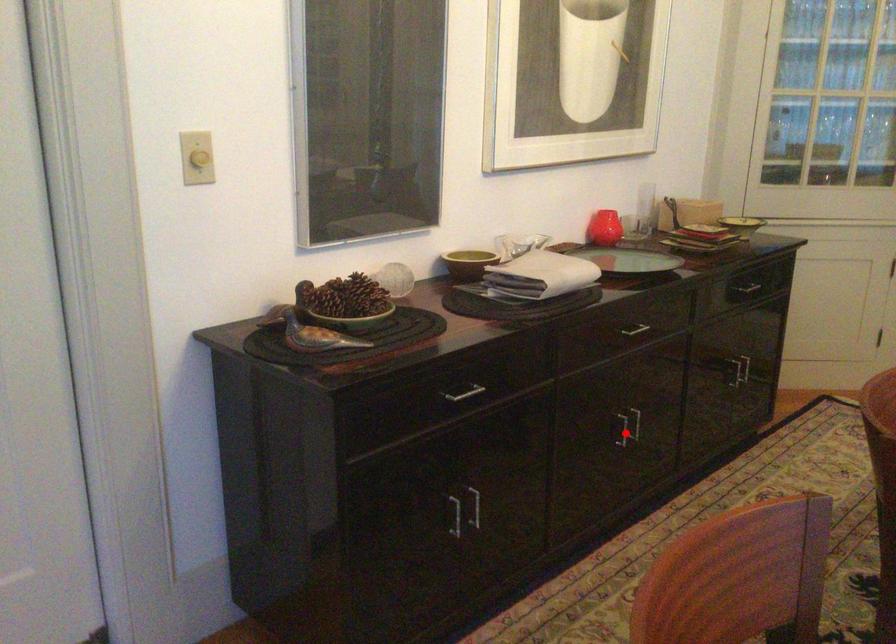
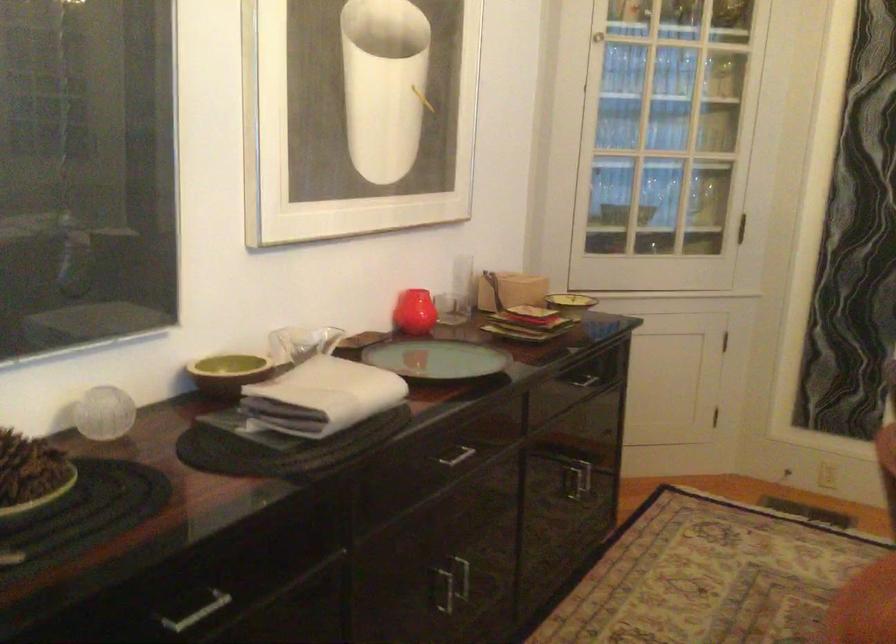
Question: I am providing you with two images of the same scene from different viewpoints. Given a red point in image1, look at the same physical point in image2. Is it:

Choices:
 (A) Closer to the viewpoint
 (B) Farther from the viewpoint

Answer: (A)